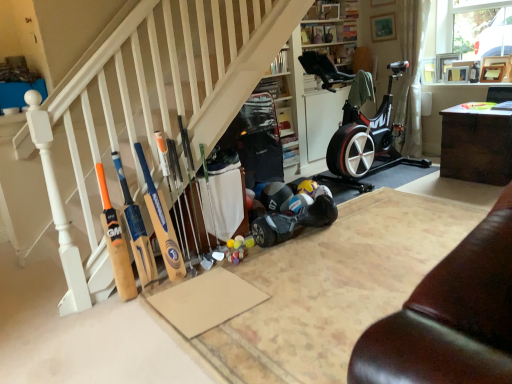
Question: Is wooden bat at left, the 3th baseball bat viewed from the right, facing towards wooden baseball bat at center, marked as the 3th baseball bat in a left-to-right arrangement?

Choices:
 (A) no
 (B) yes

Answer: (A)

Question: Is wooden bat at left, the 3th baseball bat viewed from the right, looking in the opposite direction of wooden baseball bat at center, arranged as the first baseball bat when viewed from the right?

Choices:
 (A) no
 (B) yes

Answer: (A)

Question: Does wooden bat at left, placed as the first baseball bat when sorted from left to right, have a lesser height compared to wooden baseball bat at center, marked as the 3th baseball bat in a left-to-right arrangement?

Choices:
 (A) no
 (B) yes

Answer: (B)

Question: From the image's perspective, is wooden bat at left, the 3th baseball bat viewed from the right, located above wooden baseball bat at center, marked as the 3th baseball bat in a left-to-right arrangement?

Choices:
 (A) yes
 (B) no

Answer: (B)

Question: Are wooden bat at left, the 3th baseball bat viewed from the right, and wooden baseball bat at center, marked as the 3th baseball bat in a left-to-right arrangement, far apart?

Choices:
 (A) yes
 (B) no

Answer: (B)

Question: From a real-world perspective, is wooden bat at left, placed as the first baseball bat when sorted from left to right, physically located above or below wooden baseball bat at center, marked as the 3th baseball bat in a left-to-right arrangement?

Choices:
 (A) above
 (B) below

Answer: (B)

Question: Considering the positions of point (118, 292) and point (154, 134), is point (118, 292) closer or farther from the camera than point (154, 134)?

Choices:
 (A) closer
 (B) farther

Answer: (A)

Question: Considering their positions, is wooden bat at left, the 3th baseball bat viewed from the right, located in front of or behind wooden baseball bat at center, marked as the 3th baseball bat in a left-to-right arrangement?

Choices:
 (A) behind
 (B) front

Answer: (B)

Question: Is wooden bat at left, the 3th baseball bat viewed from the right, to the left or to the right of wooden baseball bat at center, marked as the 3th baseball bat in a left-to-right arrangement, in the image?

Choices:
 (A) left
 (B) right

Answer: (A)

Question: Considering the positions of point (157, 208) and point (165, 162), is point (157, 208) closer or farther from the camera than point (165, 162)?

Choices:
 (A) closer
 (B) farther

Answer: (A)

Question: In terms of width, does wooden baseball bat at left, the second baseball bat positioned from the left, look wider or thinner when compared to wooden baseball bat at center, arranged as the first baseball bat when viewed from the right?

Choices:
 (A) thin
 (B) wide

Answer: (A)

Question: In the image, is wooden baseball bat at left, the second baseball bat positioned from the left, positioned in front of or behind wooden baseball bat at center, marked as the 3th baseball bat in a left-to-right arrangement?

Choices:
 (A) behind
 (B) front

Answer: (B)

Question: From the image's perspective, relative to wooden baseball bat at center, marked as the 3th baseball bat in a left-to-right arrangement, is wooden baseball bat at left, the second baseball bat positioned from the left, above or below?

Choices:
 (A) above
 (B) below

Answer: (B)

Question: Considering their positions, is dark wood table at right located in front of or behind wooden cricket bats at lower left?

Choices:
 (A) behind
 (B) front

Answer: (A)

Question: Considering the relative positions of dark wood table at right and wooden cricket bats at lower left in the image provided, is dark wood table at right to the left or to the right of wooden cricket bats at lower left?

Choices:
 (A) left
 (B) right

Answer: (B)